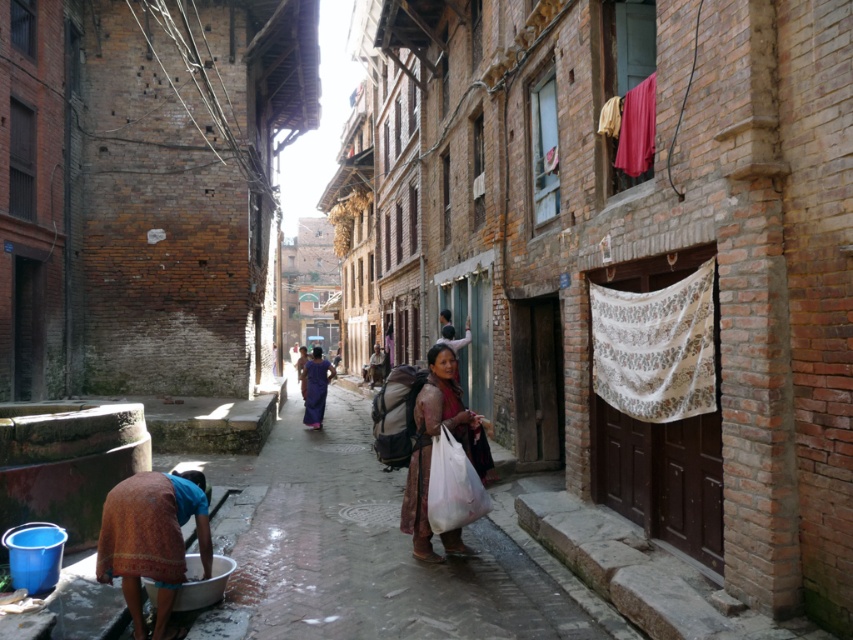
Question: Does brown woven cloth at lower left appear under brown textured shawl at center?

Choices:
 (A) yes
 (B) no

Answer: (A)

Question: Which point is closer to the camera?

Choices:
 (A) brown textured shawl at center
 (B) brown woven cloth at lower left

Answer: (B)

Question: Is brown woven cloth at lower left closer to camera compared to brown textured shawl at center?

Choices:
 (A) no
 (B) yes

Answer: (B)

Question: Is brown woven cloth at lower left thinner than brown textured shawl at center?

Choices:
 (A) yes
 (B) no

Answer: (A)

Question: Which of the following is the farthest from the observer?

Choices:
 (A) matte purple sari at center
 (B) brown textured shawl at center

Answer: (A)

Question: Which of these objects is positioned farthest from the brown woven cloth at lower left?

Choices:
 (A) brown textured shawl at center
 (B) matte purple sari at center

Answer: (B)